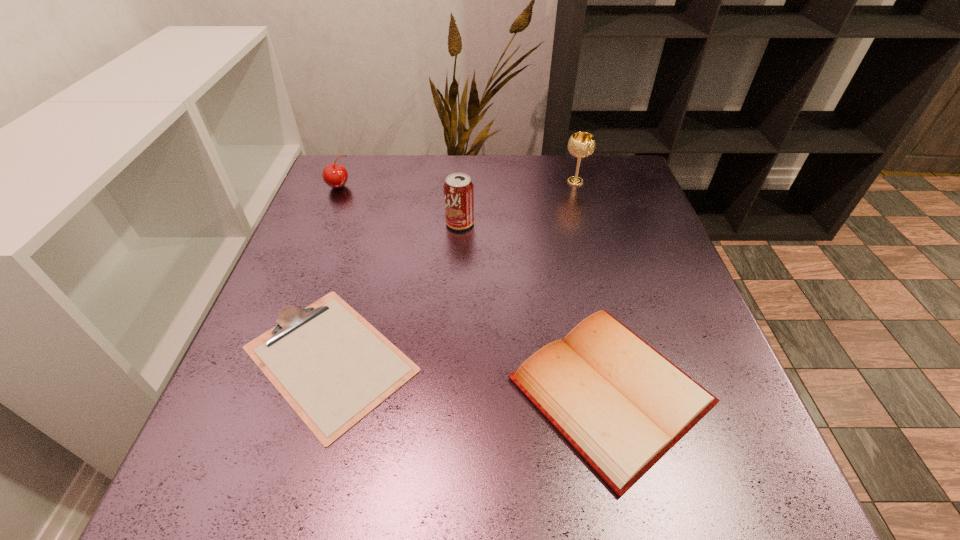
The image size is (960, 540). Identify the location of free point that satisfies the following two spatial constraints: 1. on the front side of the fourth tallest object; 2. on the left side of the shortest object. (321, 390).